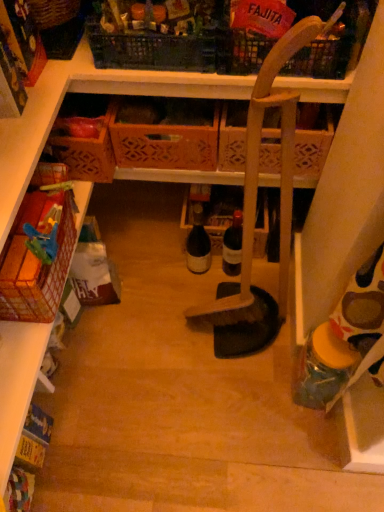
Question: From a real-world perspective, does translucent plastic jar at lower right, which ranks as the second bottle in left-to-right order, sit lower than red mesh basket at left, which ranks as the first basket in bottom-to-top order?

Choices:
 (A) no
 (B) yes

Answer: (B)

Question: Is translucent plastic jar at lower right, positioned as the first bottle in front-to-back order, touching red mesh basket at left, which appears as the 6th basket when viewed from the top?

Choices:
 (A) no
 (B) yes

Answer: (A)

Question: Does translucent plastic jar at lower right, which ranks as the second bottle in left-to-right order, have a lesser width compared to red mesh basket at left, which ranks as the first basket in bottom-to-top order?

Choices:
 (A) no
 (B) yes

Answer: (B)

Question: From the image's perspective, does translucent plastic jar at lower right, which ranks as the second bottle in left-to-right order, appear higher than red mesh basket at left, which ranks as the first basket in bottom-to-top order?

Choices:
 (A) no
 (B) yes

Answer: (A)

Question: Can we say translucent plastic jar at lower right, marked as the 1th bottle in a bottom-to-top arrangement, lies outside red mesh basket at left, which ranks as the first basket in bottom-to-top order?

Choices:
 (A) no
 (B) yes

Answer: (B)

Question: From a real-world perspective, is translucent plastic jar at lower right, positioned as the first bottle in front-to-back order, located higher than red mesh basket at left, which ranks as the first basket in bottom-to-top order?

Choices:
 (A) yes
 (B) no

Answer: (B)

Question: Could you tell me if woven brown basket at upper left, which is counted as the 5th basket, starting from the bottom, is turned towards plastic crate at upper center, which is the third basket from top to bottom?

Choices:
 (A) no
 (B) yes

Answer: (A)

Question: Is woven brown basket at upper left, placed as the 2th basket when sorted from top to bottom, facing away from plastic crate at upper center, marked as the fourth basket in a bottom-to-top arrangement?

Choices:
 (A) yes
 (B) no

Answer: (B)

Question: From a real-world perspective, is woven brown basket at upper left, which is counted as the 5th basket, starting from the bottom, located beneath plastic crate at upper center, marked as the fourth basket in a bottom-to-top arrangement?

Choices:
 (A) no
 (B) yes

Answer: (B)

Question: Would you consider woven brown basket at upper left, which is counted as the 5th basket, starting from the bottom, to be distant from plastic crate at upper center, which is the third basket from top to bottom?

Choices:
 (A) yes
 (B) no

Answer: (B)

Question: From the image's perspective, is woven brown basket at upper left, placed as the 2th basket when sorted from top to bottom, on top of plastic crate at upper center, marked as the fourth basket in a bottom-to-top arrangement?

Choices:
 (A) yes
 (B) no

Answer: (A)

Question: Does woven brown basket at upper left, placed as the 2th basket when sorted from top to bottom, have a larger size compared to plastic crate at upper center, which is the third basket from top to bottom?

Choices:
 (A) yes
 (B) no

Answer: (B)

Question: Is matte glass bottle at center, placed as the 2th bottle when sorted from right to left, outside wooden crate at center, the 5th basket positioned from the top?

Choices:
 (A) no
 (B) yes

Answer: (B)